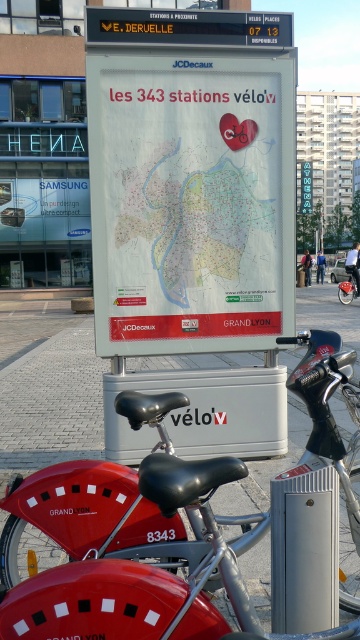
Is point (2, 524) farther from viewer compared to point (344, 288)?

No, it is not.

What do you see at coordinates (61, 513) in the screenshot? I see `brick pavement at lower center` at bounding box center [61, 513].

Is point (69, 490) farther from viewer compared to point (351, 266)?

No, (69, 490) is closer to viewer.

The height and width of the screenshot is (640, 360). In order to click on brick pavement at lower center in this screenshot , I will do `click(61, 513)`.

Is white paper map at center smaller than brick pavement at lower center?

Yes.

Locate an element on the screen. The height and width of the screenshot is (640, 360). white paper map at center is located at coordinates (186, 209).

Does white paper map at center appear over metallic silver bicycle at center?

Indeed, white paper map at center is positioned over metallic silver bicycle at center.

Is white paper map at center taller than metallic silver bicycle at center?

Correct, white paper map at center is much taller as metallic silver bicycle at center.

Which is behind, point (162, 291) or point (352, 272)?

The point (352, 272) is more distant.

The width and height of the screenshot is (360, 640). Identify the location of white paper map at center. (186, 209).